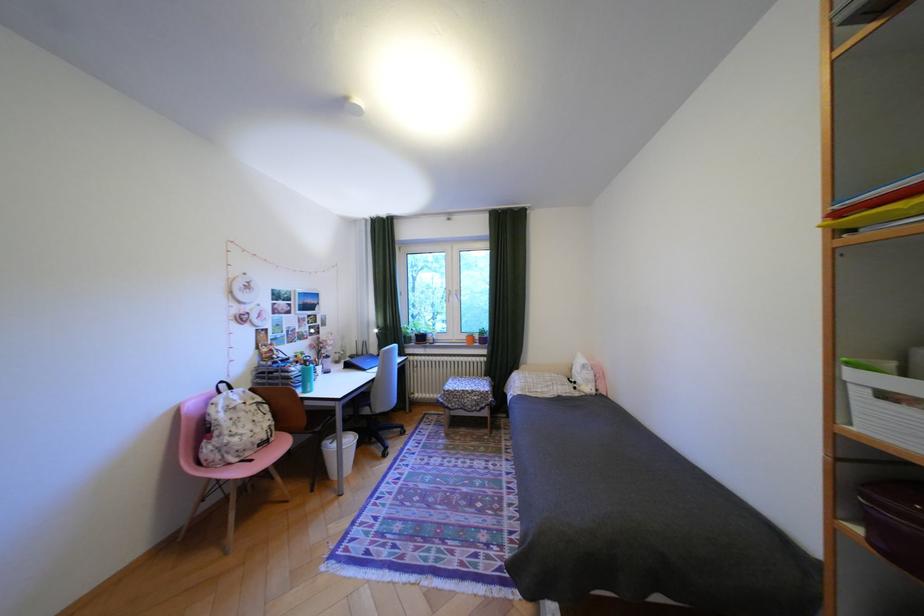
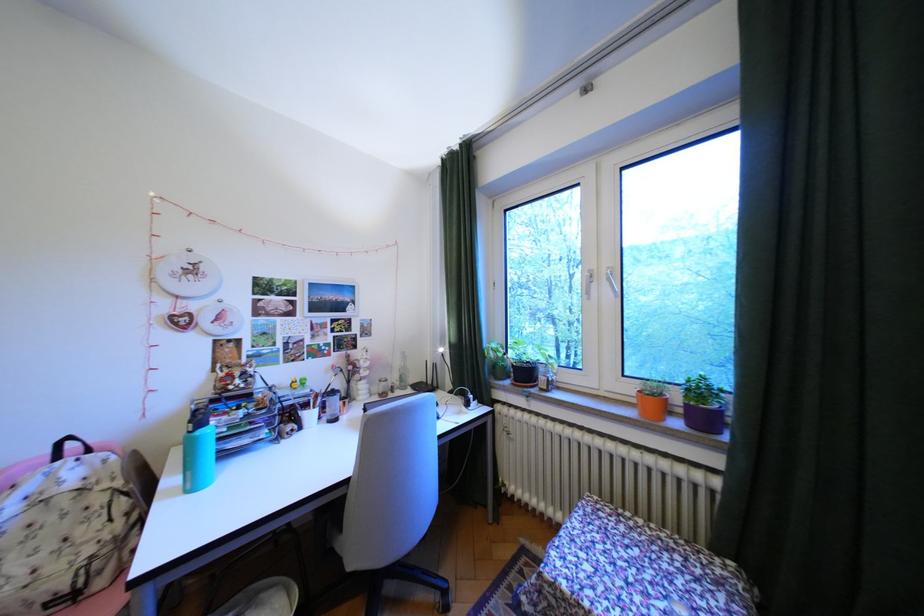
In the second image, find the point that corresponds to pixel 459 391 in the first image.

(564, 585)